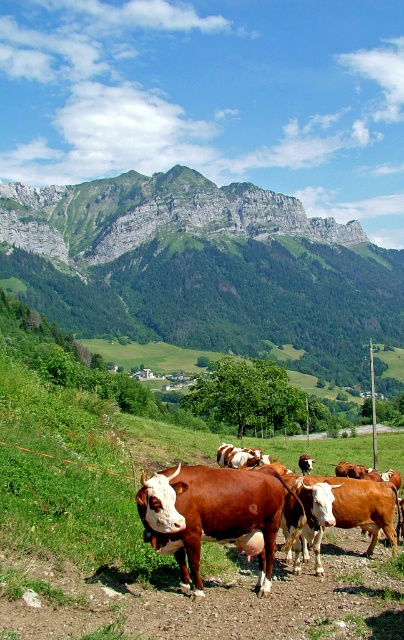
Who is higher up, green rocky mountain at upper center or rugged stone mountain at upper center?

rugged stone mountain at upper center

Does green rocky mountain at upper center have a smaller size compared to rugged stone mountain at upper center?

No, green rocky mountain at upper center is not smaller than rugged stone mountain at upper center.

Is point (195, 202) less distant than point (172, 189)?

Yes.

Where is `green rocky mountain at upper center`? green rocky mountain at upper center is located at coordinates (202, 268).

In the scene shown: Which is below, green rocky mountain at upper center or brown glossy cow at center?

brown glossy cow at center is lower down.

Who is more forward, (185, 172) or (149, 484)?

Point (149, 484) is in front.

Between point (130, 198) and point (202, 496), which one is positioned behind?

The point (130, 198) is more distant.

Locate an element on the screen. The width and height of the screenshot is (404, 640). green rocky mountain at upper center is located at coordinates (202, 268).

Can you confirm if rugged stone mountain at upper center is shorter than brown glossy cow at center?

Incorrect, rugged stone mountain at upper center's height does not fall short of brown glossy cow at center's.

Is rugged stone mountain at upper center thinner than brown glossy cow at center?

No, rugged stone mountain at upper center is not thinner than brown glossy cow at center.

Does point (300, 204) come closer to viewer compared to point (214, 529)?

No, (300, 204) is further to viewer.

You are a GUI agent. You are given a task and a screenshot of the screen. Output one action in this format:
    pyautogui.click(x=<x>, y=<y>)
    Task: Click on the rugged stone mountain at upper center
    
    Given the screenshot: What is the action you would take?
    pyautogui.click(x=151, y=216)